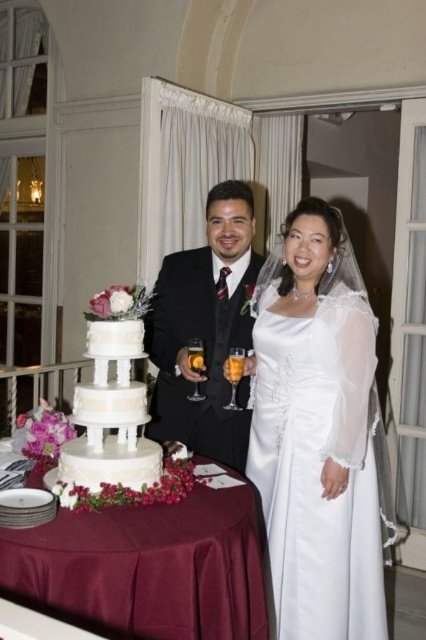
Does white satin wedding dress at center appear on the left side of shiny black suit at center?

In fact, white satin wedding dress at center is to the right of shiny black suit at center.

Is white satin wedding dress at center smaller than shiny black suit at center?

No.

Locate an element on the screen. white satin wedding dress at center is located at coordinates (319, 467).

At what (x,y) coordinates should I click in order to perform the action: click on white satin wedding dress at center. Please return your answer as a coordinate pair (x, y). The width and height of the screenshot is (426, 640). Looking at the image, I should click on (319, 467).

Which is above, shiny black suit at center or white matte wedding cake at lower left?

Positioned higher is shiny black suit at center.

Who is more distant from viewer, (201, 264) or (89, 474)?

Positioned behind is point (201, 264).

Identify the location of shiny black suit at center. This screenshot has width=426, height=640. (206, 330).

I want to click on shiny black suit at center, so click(206, 330).

Who is taller, maroon satin tablecloth at center or shiny black suit at center?

shiny black suit at center

Measure the distance between point (215, 570) and camera.

Point (215, 570) and camera are 1.57 meters apart from each other.

Between point (155, 529) and point (218, 218), which one is positioned behind?

The point (218, 218) is behind.

Find the location of a particular element. maroon satin tablecloth at center is located at coordinates (146, 566).